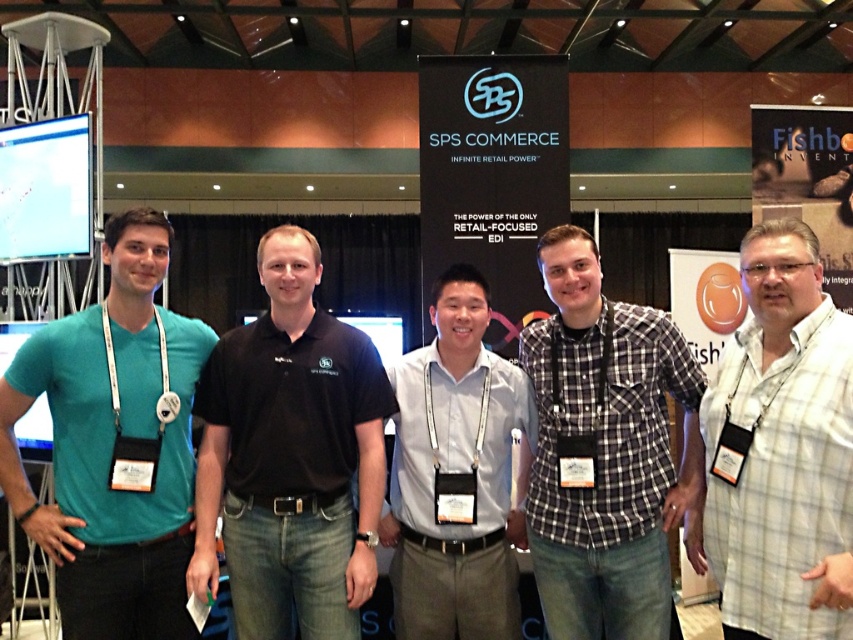
You are standing in front of the backdrop at the trade show and notice the black cotton polo shirt at center. Can you determine its exact position using the coordinate system provided?

The black cotton polo shirt at center is located at point (289, 458) in the coordinate system.